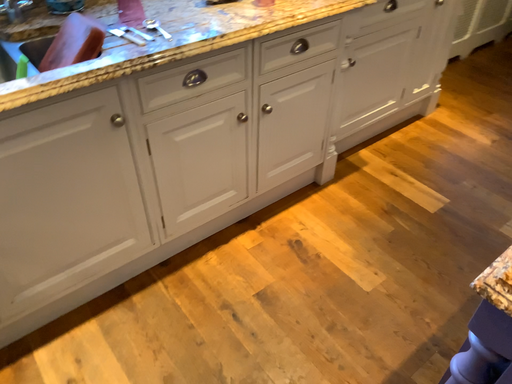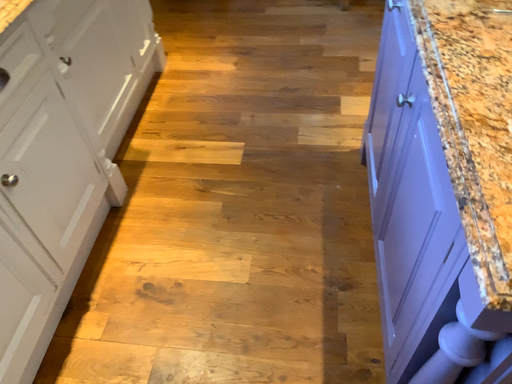
Question: How did the camera likely rotate when shooting the video?

Choices:
 (A) rotated left
 (B) rotated right

Answer: (B)